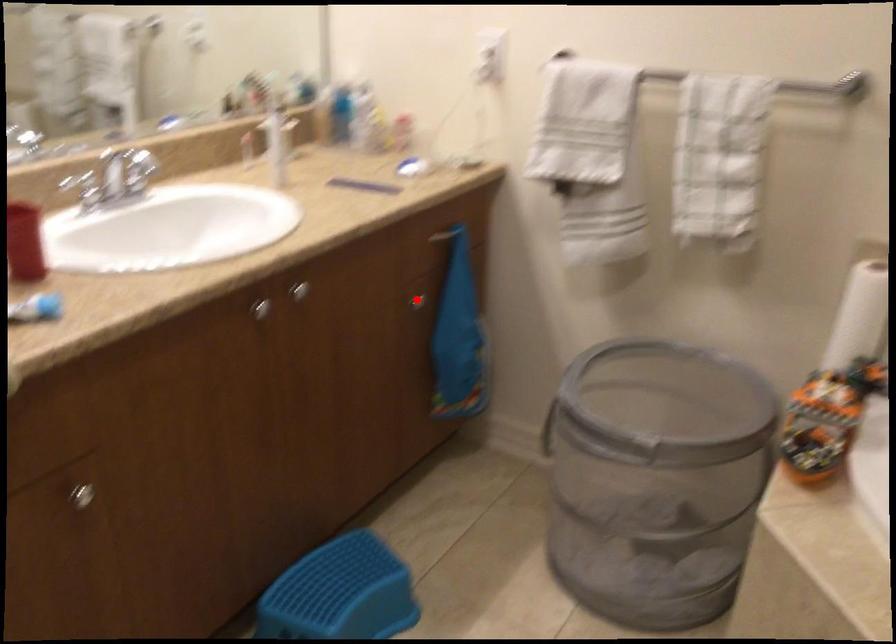
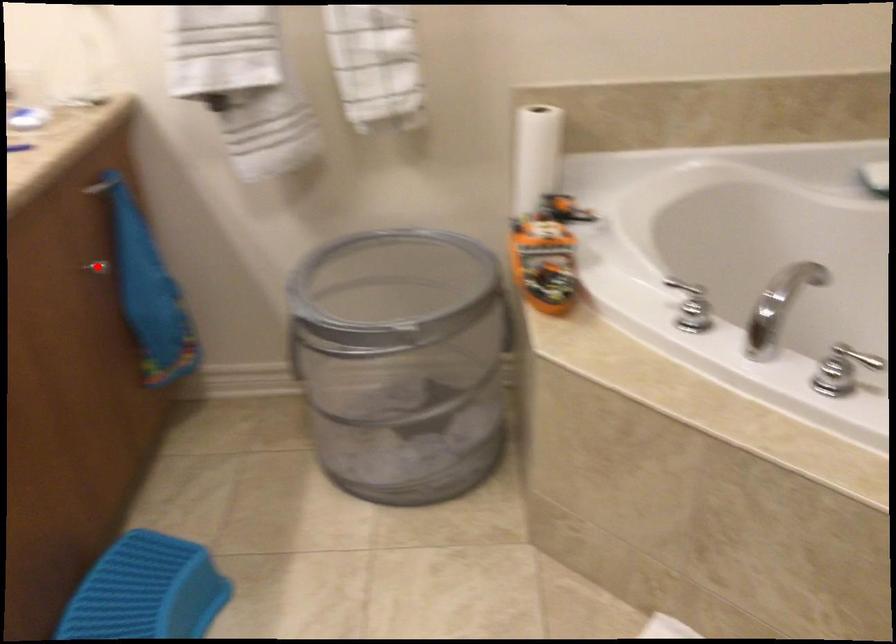
I am providing you with two images of the same scene from different viewpoints. A red point is marked on the first image and another point is marked on the second image. Are the points marked in image1 and image2 representing the same 3D position?

Yes